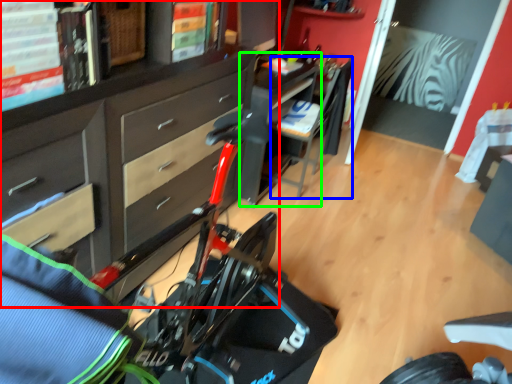
Question: Considering the real-world distances, which object is farthest from cabinetry (highlighted by a red box)? chair (highlighted by a blue box) or table (highlighted by a green box)?

Choices:
 (A) chair
 (B) table

Answer: (A)